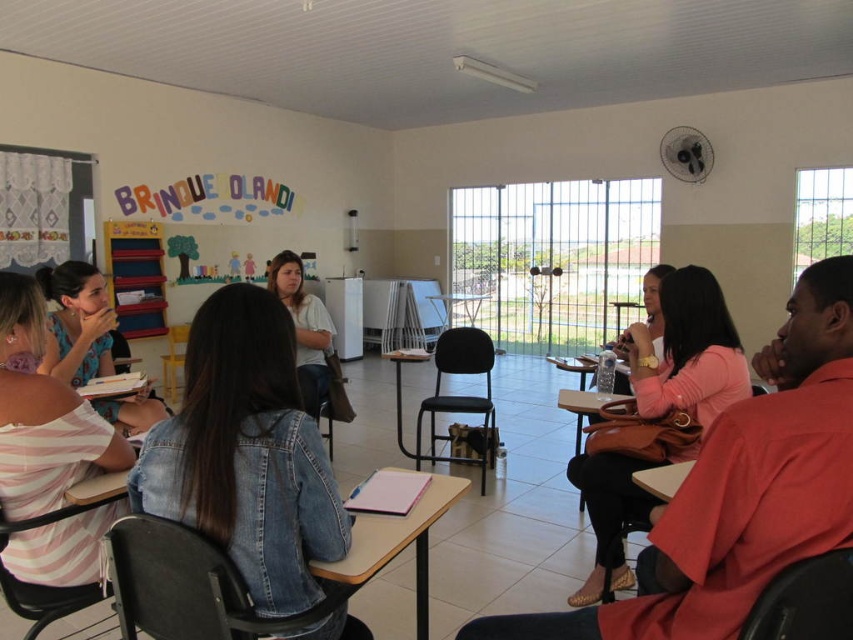
You are standing in the classroom and want to place a new poster on the wall. The poster is 0.8 meters wide. There is a pink leather handbag at right hanging at point (741, 490). Can you hang the poster without overlapping the handbag?

The point (741, 490) indicates the location of the pink leather handbag at right. Since the poster is 0.8 meters wide, you need to ensure there is enough space on the wall. However, without knowing the exact dimensions of the wall or the distance from the handbag to the edges, it is impossible to determine if the poster can be placed without overlapping. Additional measurements are required.